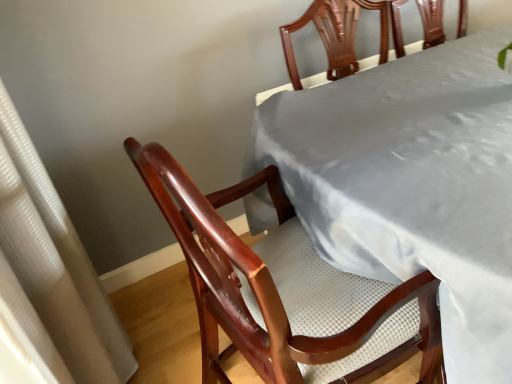
Question: Considering the relative sizes of satin gray tablecloth at upper center and white textured curtain at left in the image provided, is satin gray tablecloth at upper center smaller than white textured curtain at left?

Choices:
 (A) no
 (B) yes

Answer: (A)

Question: Is white textured curtain at left inside satin gray tablecloth at upper center?

Choices:
 (A) no
 (B) yes

Answer: (A)

Question: Can you confirm if satin gray tablecloth at upper center is shorter than white textured curtain at left?

Choices:
 (A) no
 (B) yes

Answer: (B)

Question: Considering the relative positions of satin gray tablecloth at upper center and white textured curtain at left in the image provided, is satin gray tablecloth at upper center to the right of white textured curtain at left from the viewer's perspective?

Choices:
 (A) no
 (B) yes

Answer: (B)

Question: From a real-world perspective, does satin gray tablecloth at upper center stand above white textured curtain at left?

Choices:
 (A) yes
 (B) no

Answer: (B)

Question: Considering the relative sizes of satin gray tablecloth at upper center and white textured curtain at left in the image provided, is satin gray tablecloth at upper center wider than white textured curtain at left?

Choices:
 (A) no
 (B) yes

Answer: (B)

Question: Considering the relative sizes of white textured curtain at left and satin gray tablecloth at upper center in the image provided, is white textured curtain at left thinner than satin gray tablecloth at upper center?

Choices:
 (A) no
 (B) yes

Answer: (B)

Question: Is white textured curtain at left looking in the opposite direction of satin gray tablecloth at upper center?

Choices:
 (A) yes
 (B) no

Answer: (B)

Question: Could you tell me if white textured curtain at left is facing satin gray tablecloth at upper center?

Choices:
 (A) no
 (B) yes

Answer: (B)

Question: Is white textured curtain at left touching satin gray tablecloth at upper center?

Choices:
 (A) yes
 (B) no

Answer: (B)

Question: From the image's perspective, is white textured curtain at left located beneath satin gray tablecloth at upper center?

Choices:
 (A) yes
 (B) no

Answer: (A)

Question: Is satin gray tablecloth at upper center a part of white textured curtain at left?

Choices:
 (A) no
 (B) yes

Answer: (A)

Question: Which is correct: white textured curtain at left is inside satin gray tablecloth at upper center, or outside of it?

Choices:
 (A) inside
 (B) outside

Answer: (B)